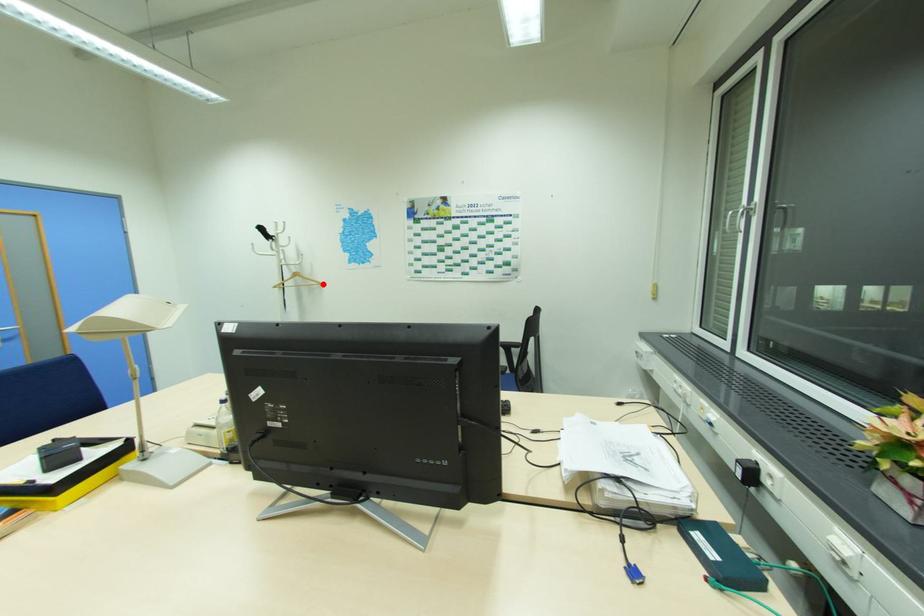
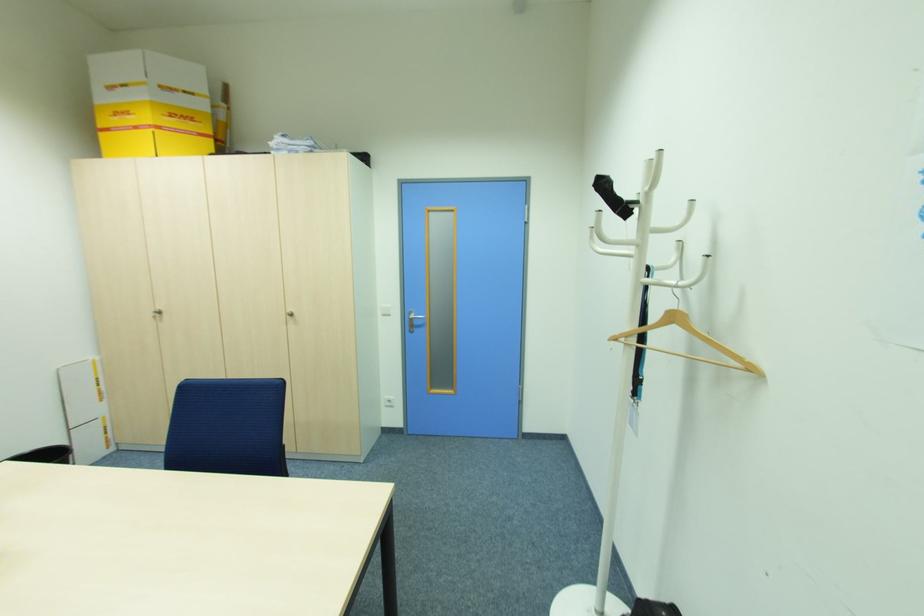
Find the pixel in the second image that matches the highlighted location in the first image.

(756, 370)